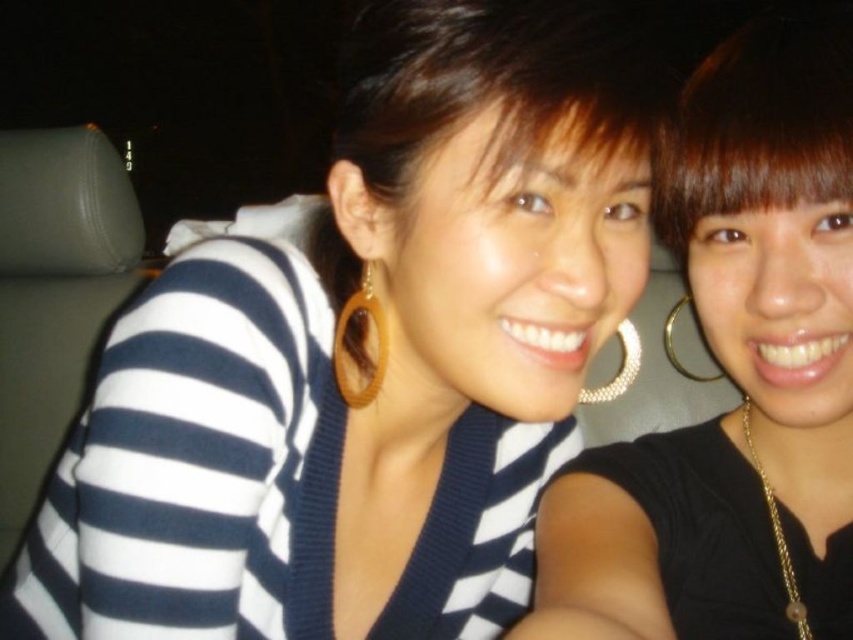
Question: Does matte black sweater at center appear over brown hair at upper right?

Choices:
 (A) yes
 (B) no

Answer: (B)

Question: Which object appears closest to the camera in this image?

Choices:
 (A) matte black sweater at center
 (B) brown hair at upper right

Answer: (A)

Question: Which object is farther from the camera taking this photo?

Choices:
 (A) brown hair at upper right
 (B) matte black sweater at center

Answer: (A)

Question: Among these objects, which one is nearest to the camera?

Choices:
 (A) brown hair at upper right
 (B) matte black sweater at center

Answer: (B)

Question: Is matte black sweater at center further to the viewer compared to brown hair at upper right?

Choices:
 (A) yes
 (B) no

Answer: (B)

Question: Can you confirm if matte black sweater at center is wider than brown hair at upper right?

Choices:
 (A) yes
 (B) no

Answer: (A)